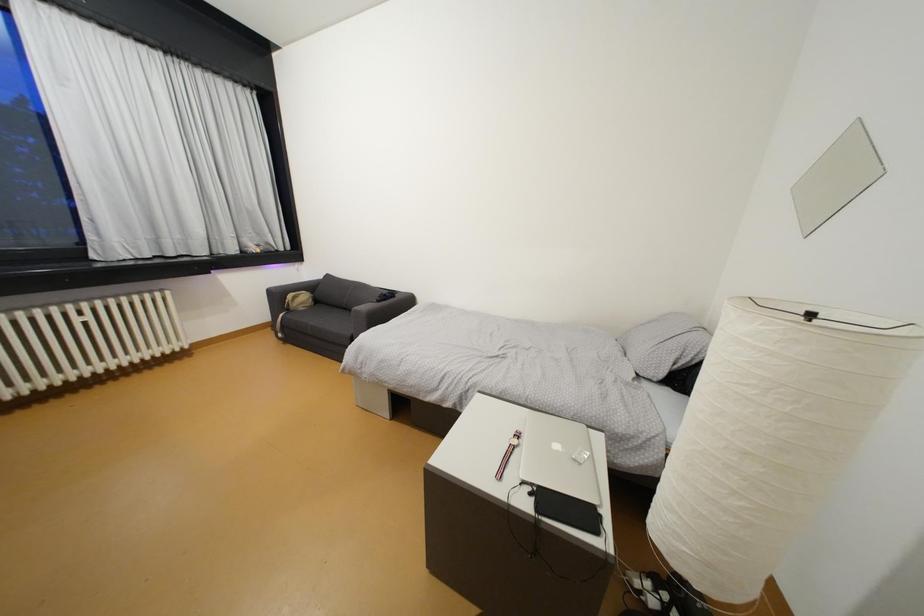
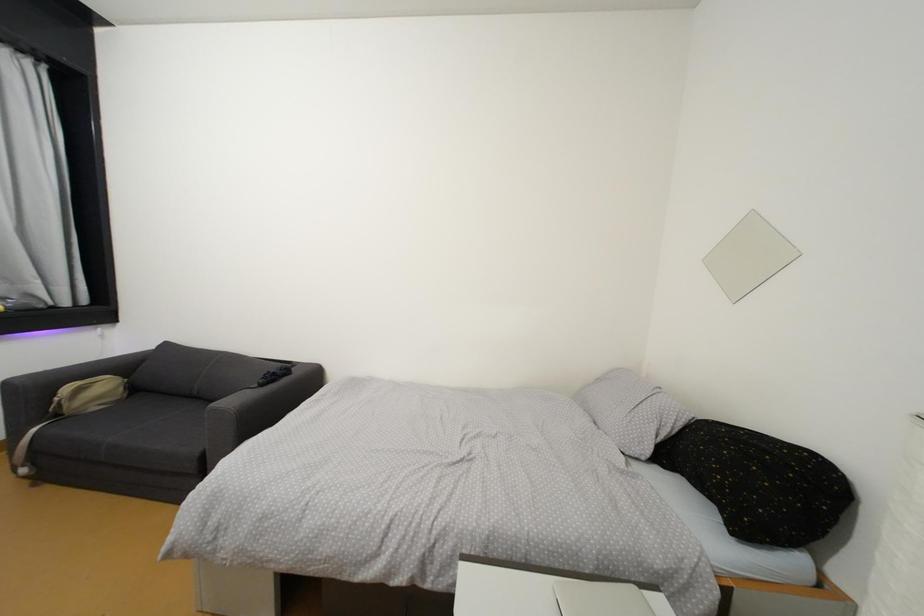
In a continuous first-person perspective shot, in which direction is the camera moving?

The cameraman moved toward left, forward.